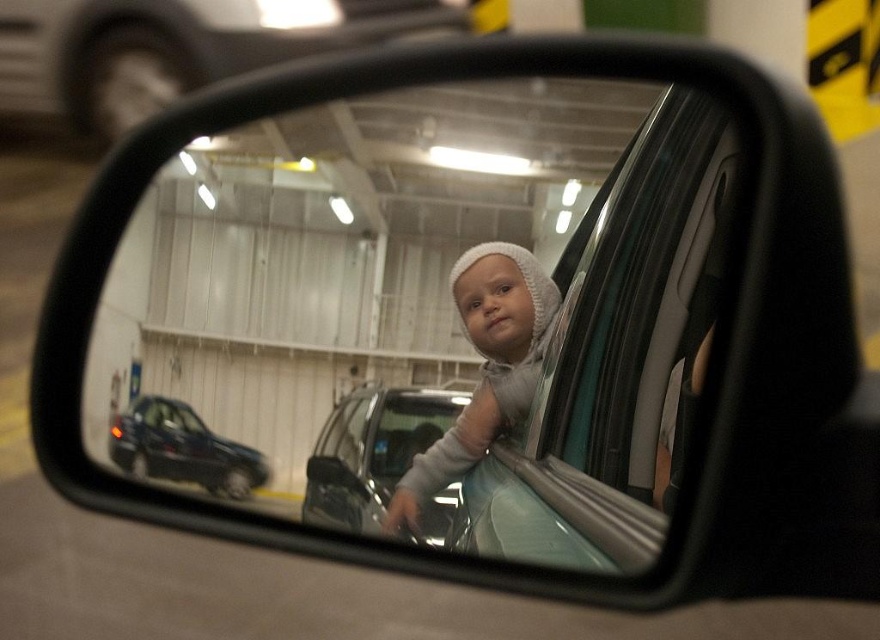
In the scene shown: Which is more to the left, metallic car at upper center or metallic gray car at center?

metallic car at upper center is more to the left.

This screenshot has width=880, height=640. In order to click on metallic car at upper center in this screenshot , I will do `click(176, 49)`.

Does point (31, 58) come in front of point (452, 486)?

No, (31, 58) is behind (452, 486).

I want to click on metallic car at upper center, so click(x=176, y=49).

Can you confirm if white knit hat at center is positioned to the right of metallic gray car at center?

Correct, you'll find white knit hat at center to the right of metallic gray car at center.

Based on the photo, can you confirm if white knit hat at center is positioned below metallic gray car at center?

Incorrect, white knit hat at center is not positioned below metallic gray car at center.

Between point (495, 320) and point (412, 448), which one is positioned behind?

Point (412, 448)

Locate an element on the screen. The image size is (880, 640). white knit hat at center is located at coordinates (484, 368).

Does metallic gray car at center have a larger size compared to shiny black car at lower left?

Correct, metallic gray car at center is larger in size than shiny black car at lower left.

I want to click on metallic gray car at center, so click(x=372, y=451).